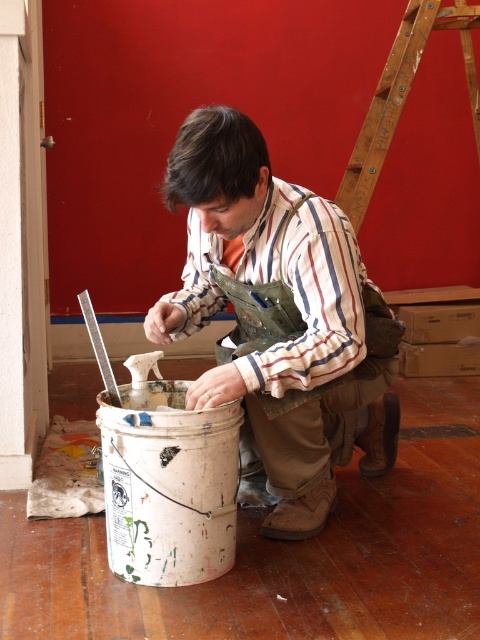
From the picture: Can you confirm if matte striped shirt at center is positioned below wooden ladder at upper right?

Yes.

Based on the photo, is matte striped shirt at center to the right of wooden ladder at upper right from the viewer's perspective?

Incorrect, matte striped shirt at center is not on the right side of wooden ladder at upper right.

Is point (362, 464) more distant than point (384, 150)?

No, it is in front of (384, 150).

I want to click on matte striped shirt at center, so 279,316.